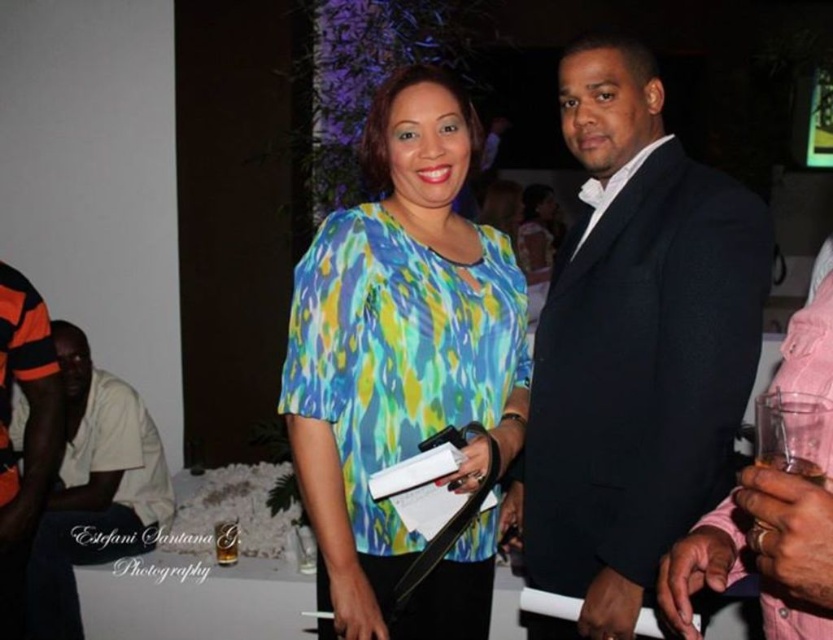
Can you confirm if black wool suit at center is smaller than orange and black striped shirt at left?

No.

Does black wool suit at center appear on the left side of orange and black striped shirt at left?

No, black wool suit at center is not to the left of orange and black striped shirt at left.

In order to click on black wool suit at center in this screenshot , I will do `click(632, 348)`.

This screenshot has width=833, height=640. Identify the location of black wool suit at center. (632, 348).

Between point (719, 404) and point (402, 445), which one is positioned behind?

Point (402, 445)

Is black wool suit at center shorter than printed fabric blouse at center?

No, black wool suit at center is not shorter than printed fabric blouse at center.

Does point (647, 529) come closer to viewer compared to point (427, 342)?

Yes, point (647, 529) is closer to viewer.

In order to click on black wool suit at center in this screenshot , I will do `click(632, 348)`.

Is orange striped shirt at left below orange and black striped shirt at left?

Yes.

Between point (66, 512) and point (36, 410), which one is positioned behind?

The point (66, 512) is behind.

Between point (101, 557) and point (18, 474), which one is positioned in front?

Point (101, 557)

This screenshot has height=640, width=833. I want to click on orange striped shirt at left, so click(93, 488).